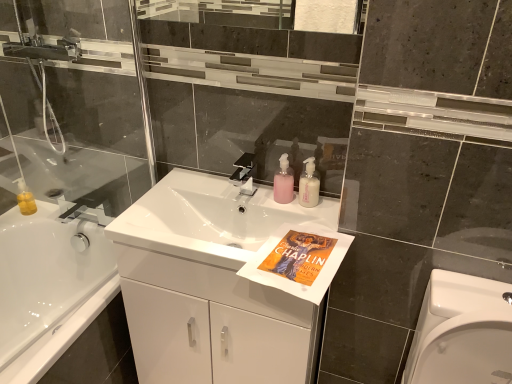
Question: From the image's perspective, is satin nickel faucet at center above or below white glossy sink at center?

Choices:
 (A) below
 (B) above

Answer: (B)

Question: Is point (247, 193) closer or farther from the camera than point (163, 246)?

Choices:
 (A) closer
 (B) farther

Answer: (B)

Question: Estimate the real-world distances between objects in this image. Which object is closer to the white glossy cabinet at center?

Choices:
 (A) white glossy sink at center
 (B) white glossy bathtub at left
 (C) pink matte soap dispenser at center, marked as the 2th toiletry in a left-to-right arrangement
 (D) satin nickel faucet at center
 (E) pink translucent pump bottle at center, which is counted as the first toiletry, starting from the left

Answer: (A)

Question: Which object is positioned farthest from the transparent glass shower door at left?

Choices:
 (A) satin nickel faucet at center
 (B) white glossy bathtub at left
 (C) white glossy cabinet at center
 (D) pink matte soap dispenser at center, which ranks as the first toiletry in right-to-left order
 (E) white glossy sink at center

Answer: (D)